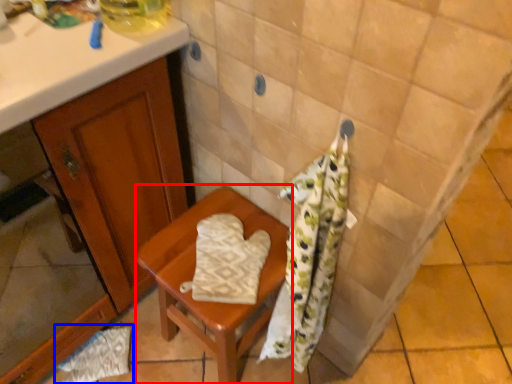
Question: Which of the following is the closest to the observer, furniture (highlighted by a red box) or material (highlighted by a blue box)?

Choices:
 (A) furniture
 (B) material

Answer: (A)